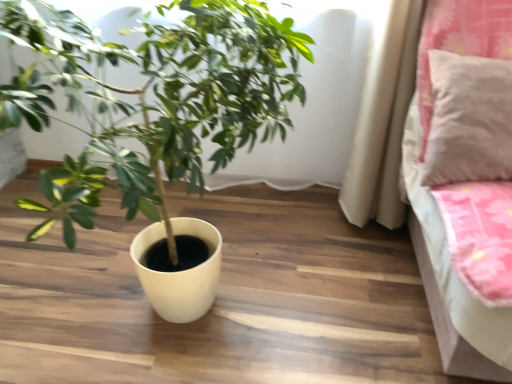
Question: Can you confirm if matte white pot at center is wider than pink fabric pillow at upper right?

Choices:
 (A) yes
 (B) no

Answer: (A)

Question: Would you say matte white pot at center is outside pink fabric pillow at upper right?

Choices:
 (A) yes
 (B) no

Answer: (A)

Question: Does matte white pot at center come in front of pink fabric pillow at upper right?

Choices:
 (A) no
 (B) yes

Answer: (B)

Question: Is matte white pot at center far away from pink fabric pillow at upper right?

Choices:
 (A) no
 (B) yes

Answer: (A)

Question: From the image's perspective, does matte white pot at center appear lower than pink fabric pillow at upper right?

Choices:
 (A) no
 (B) yes

Answer: (B)

Question: From a real-world perspective, is matte white pot at center positioned under pink fabric pillow at upper right based on gravity?

Choices:
 (A) yes
 (B) no

Answer: (A)

Question: Is pink fabric pillow at upper right to the left of matte white pot at center from the viewer's perspective?

Choices:
 (A) no
 (B) yes

Answer: (A)

Question: Is matte white pot at center at the back of pink fabric pillow at upper right?

Choices:
 (A) no
 (B) yes

Answer: (A)

Question: From a real-world perspective, is pink fabric pillow at upper right located beneath matte white pot at center?

Choices:
 (A) yes
 (B) no

Answer: (B)

Question: Could you tell me if pink fabric pillow at upper right is facing matte white pot at center?

Choices:
 (A) no
 (B) yes

Answer: (A)

Question: Is pink fabric pillow at upper right completely or partially outside of matte white pot at center?

Choices:
 (A) no
 (B) yes

Answer: (B)

Question: Considering the relative sizes of pink fabric pillow at upper right and matte white pot at center in the image provided, is pink fabric pillow at upper right shorter than matte white pot at center?

Choices:
 (A) yes
 (B) no

Answer: (A)

Question: Considering the positions of point (481, 117) and point (185, 54), is point (481, 117) closer or farther from the camera than point (185, 54)?

Choices:
 (A) closer
 (B) farther

Answer: (A)